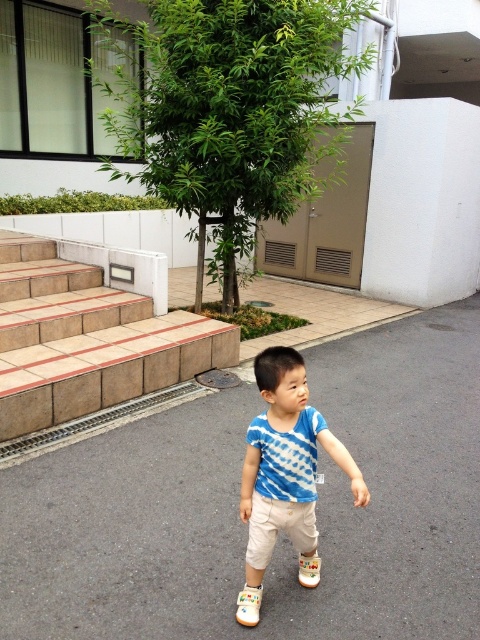
Question: Estimate the real-world distances between objects in this image. Which object is farther from the blue tie-dye shirt at center?

Choices:
 (A) brown tile stairs at left
 (B) white suede shoe at center
 (C) gray asphalt pavement at center
 (D) white fabric shoe at center

Answer: (A)

Question: Among these points, which one is farthest from the camera?

Choices:
 (A) (300, 572)
 (B) (197, 433)
 (C) (34, 288)

Answer: (C)

Question: Which object is closer to the camera taking this photo?

Choices:
 (A) white fabric shoe at center
 (B) white suede shoe at center

Answer: (B)

Question: Does brown tile stairs at left have a greater width compared to blue tie-dye shirt at center?

Choices:
 (A) yes
 (B) no

Answer: (A)

Question: Is brown tile stairs at left thinner than blue tie-dye shirt at center?

Choices:
 (A) no
 (B) yes

Answer: (A)

Question: Can you confirm if gray asphalt pavement at center is thinner than white suede shoe at center?

Choices:
 (A) no
 (B) yes

Answer: (A)